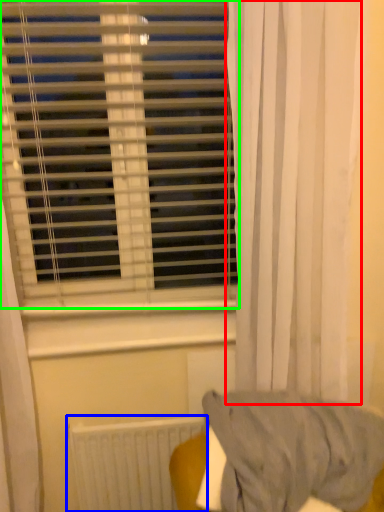
Question: Based on their relative distances, which object is nearer to curtain (highlighted by a red box)? Choose from radiator (highlighted by a blue box) and window blind (highlighted by a green box).

Choices:
 (A) radiator
 (B) window blind

Answer: (B)